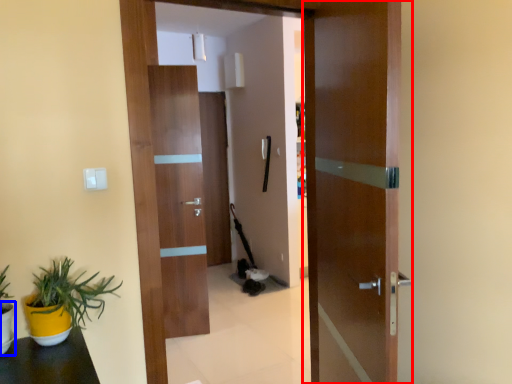
Question: Which point is closer to the camera, door (highlighted by a red box) or flowerpot (highlighted by a blue box)?

Choices:
 (A) door
 (B) flowerpot

Answer: (A)